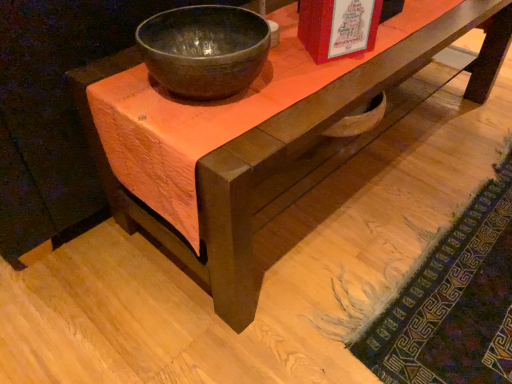
Identify the location of vacant area that is in front of matte red book at upper center. (329, 82).